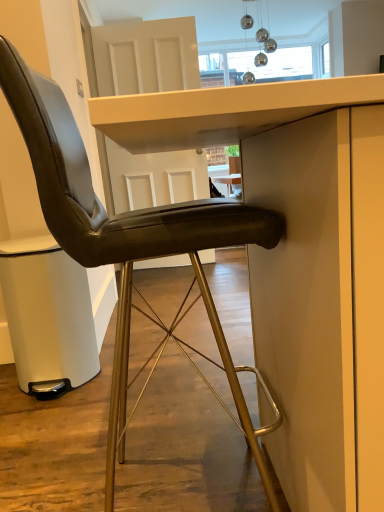
Question: Is black leather chair at center not within matte white table at center?

Choices:
 (A) no
 (B) yes

Answer: (A)

Question: Considering the relative sizes of black leather chair at center and matte white table at center in the image provided, is black leather chair at center taller than matte white table at center?

Choices:
 (A) yes
 (B) no

Answer: (A)

Question: Can you confirm if black leather chair at center is shorter than matte white table at center?

Choices:
 (A) yes
 (B) no

Answer: (B)

Question: From the image's perspective, is black leather chair at center under matte white table at center?

Choices:
 (A) yes
 (B) no

Answer: (B)

Question: Does black leather chair at center touch matte white table at center?

Choices:
 (A) no
 (B) yes

Answer: (A)

Question: Does black leather chair at center turn towards matte white table at center?

Choices:
 (A) no
 (B) yes

Answer: (B)

Question: Does matte white table at center have a greater height compared to black leather chair at center?

Choices:
 (A) yes
 (B) no

Answer: (B)

Question: Is matte white table at center further to camera compared to black leather chair at center?

Choices:
 (A) yes
 (B) no

Answer: (B)

Question: From a real-world perspective, is matte white table at center located beneath black leather chair at center?

Choices:
 (A) no
 (B) yes

Answer: (B)

Question: Could you tell me if matte white table at center is turned towards black leather chair at center?

Choices:
 (A) no
 (B) yes

Answer: (A)

Question: Does matte white table at center have a lesser height compared to black leather chair at center?

Choices:
 (A) yes
 (B) no

Answer: (A)

Question: Does matte white table at center have a larger size compared to black leather chair at center?

Choices:
 (A) no
 (B) yes

Answer: (B)

Question: Is point (117, 406) positioned closer to the camera than point (92, 123)?

Choices:
 (A) closer
 (B) farther

Answer: (B)